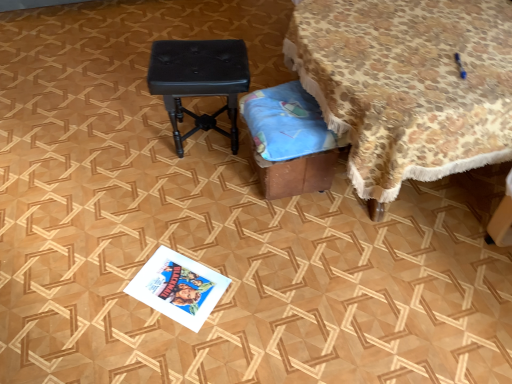
The image size is (512, 384). I want to click on free region under black leather stool at center (from a real-world perspective), so click(x=204, y=140).